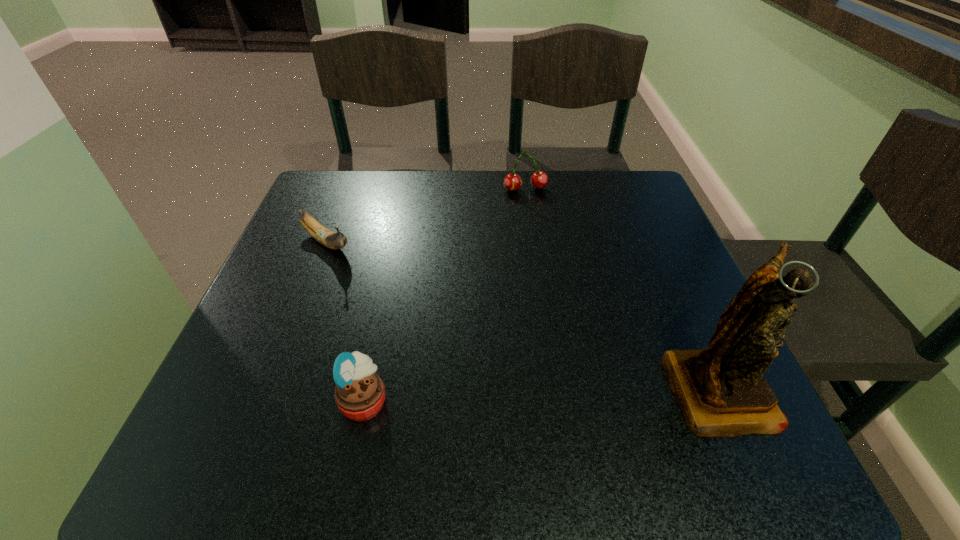
The width and height of the screenshot is (960, 540). Identify the location of vacant space that satisfies the following two spatial constraints: 1. on the front side of the shortest object; 2. on the front-facing side of the third object from right to left. (264, 400).

Locate an element on the screen. This screenshot has width=960, height=540. blank space that satisfies the following two spatial constraints: 1. on the front side of the third nearest object; 2. on the front-facing side of the tallest object is located at coordinates (270, 387).